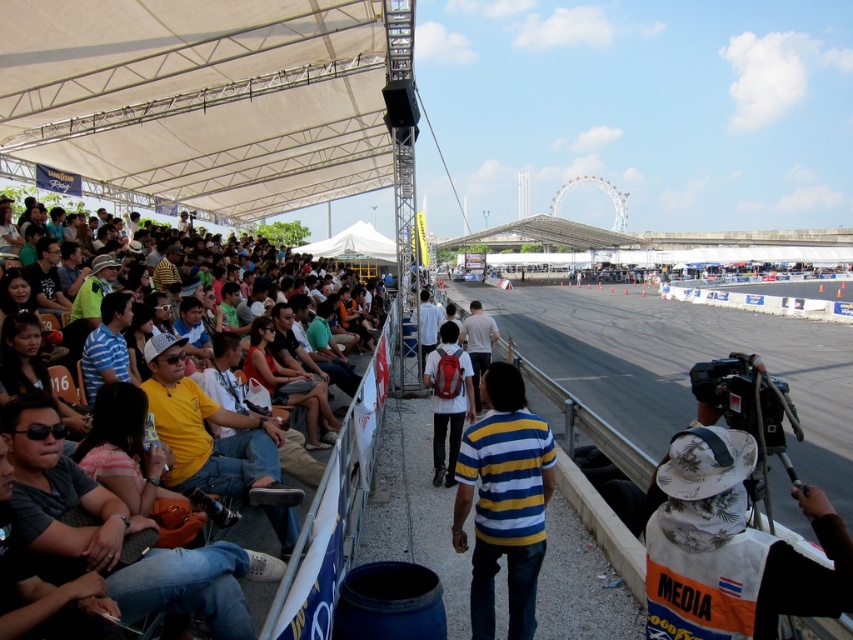
Question: Does white matte backpack at center have a larger size compared to matte black shirt at center?

Choices:
 (A) yes
 (B) no

Answer: (B)

Question: Does white matte backpack at center lie behind matte black shirt at center?

Choices:
 (A) no
 (B) yes

Answer: (B)

Question: Which of the following is the farthest from the observer?

Choices:
 (A) (254, 320)
 (B) (457, 348)

Answer: (A)

Question: Among these points, which one is farthest from the camera?

Choices:
 (A) (463, 387)
 (B) (277, 369)
 (C) (496, 561)
 (D) (332, 396)

Answer: (D)

Question: Which point is farther from the camera taking this photo?

Choices:
 (A) click(x=456, y=435)
 (B) click(x=328, y=424)
 (C) click(x=334, y=454)
 (D) click(x=486, y=627)

Answer: (B)

Question: Where is yellow striped shirt at center located in relation to matte black shirt at center in the image?

Choices:
 (A) left
 (B) right

Answer: (B)